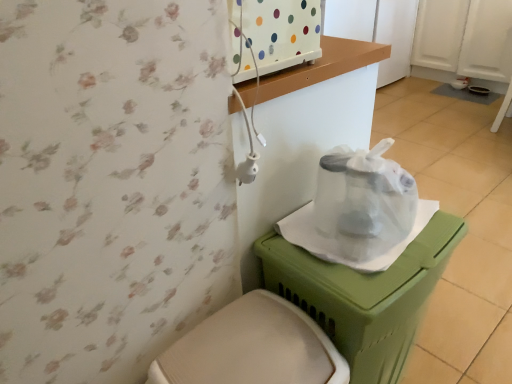
Question: Based on their positions, is green plastic potty at lower right located to the left or right of white plastic toilet at lower center?

Choices:
 (A) left
 (B) right

Answer: (B)

Question: From a real-world perspective, is green plastic potty at lower right above or below white plastic toilet at lower center?

Choices:
 (A) below
 (B) above

Answer: (B)

Question: Which object is the closest to the transparent plastic bag at center?

Choices:
 (A) green plastic potty at lower right
 (B) white plastic toilet at lower center

Answer: (A)

Question: Which is nearer to the green plastic potty at lower right?

Choices:
 (A) transparent plastic bag at center
 (B) white plastic toilet at lower center

Answer: (A)